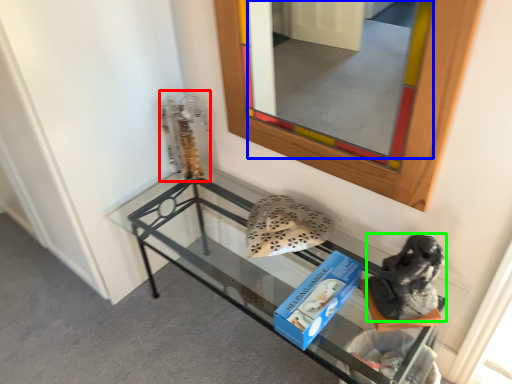
Question: Estimate the real-world distances between objects in this image. Which object is farther from sculpture (highlighted by a red box), mirror (highlighted by a blue box) or footwear (highlighted by a green box)?

Choices:
 (A) mirror
 (B) footwear

Answer: (A)